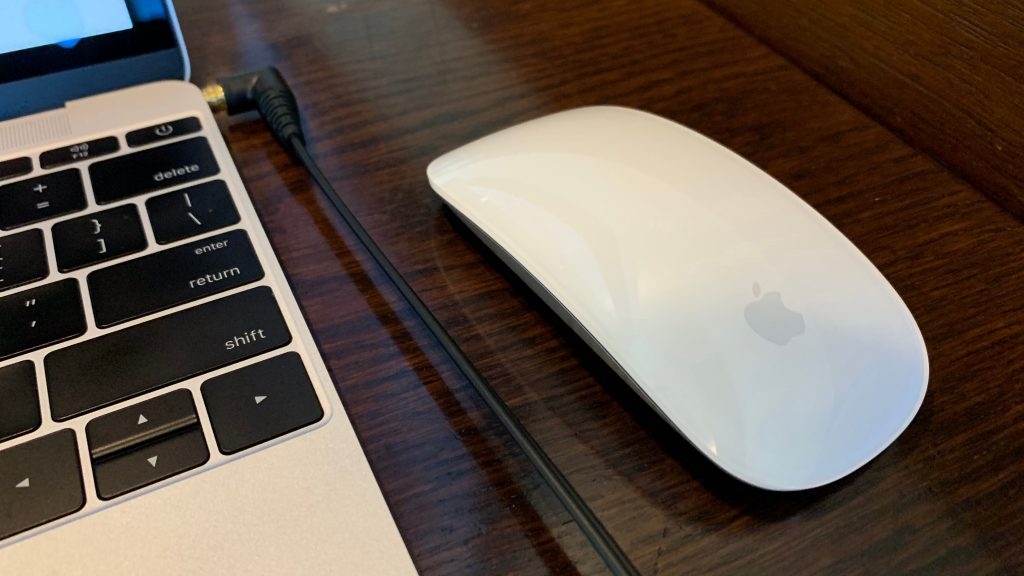
You are a GUI agent. You are given a task and a screenshot of the screen. Output one action in this format:
    pyautogui.click(x=<x>, y=<y>)
    Task: Click on the wood desk
    The width and height of the screenshot is (1024, 576).
    Given the screenshot: What is the action you would take?
    pyautogui.click(x=948, y=74), pyautogui.click(x=895, y=162), pyautogui.click(x=479, y=312), pyautogui.click(x=370, y=341)